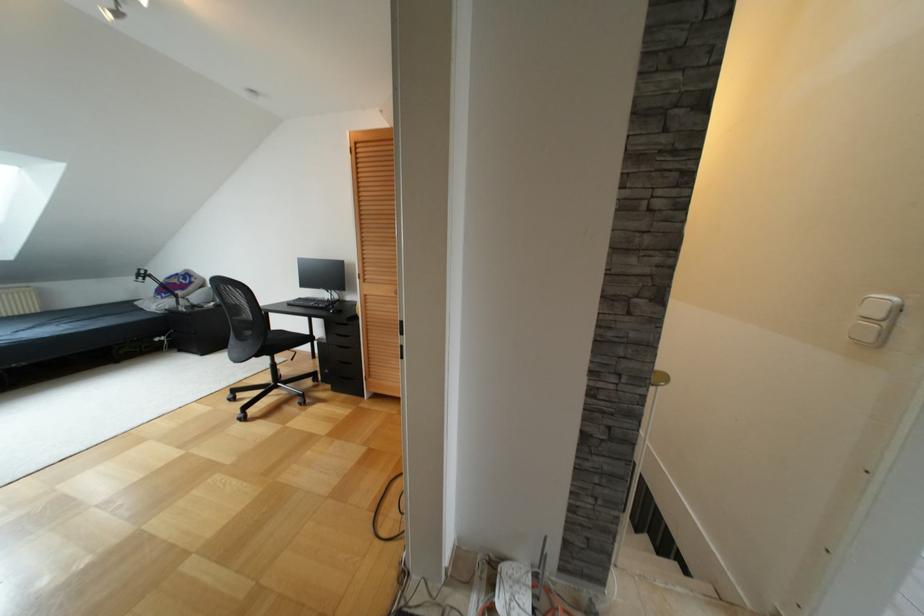
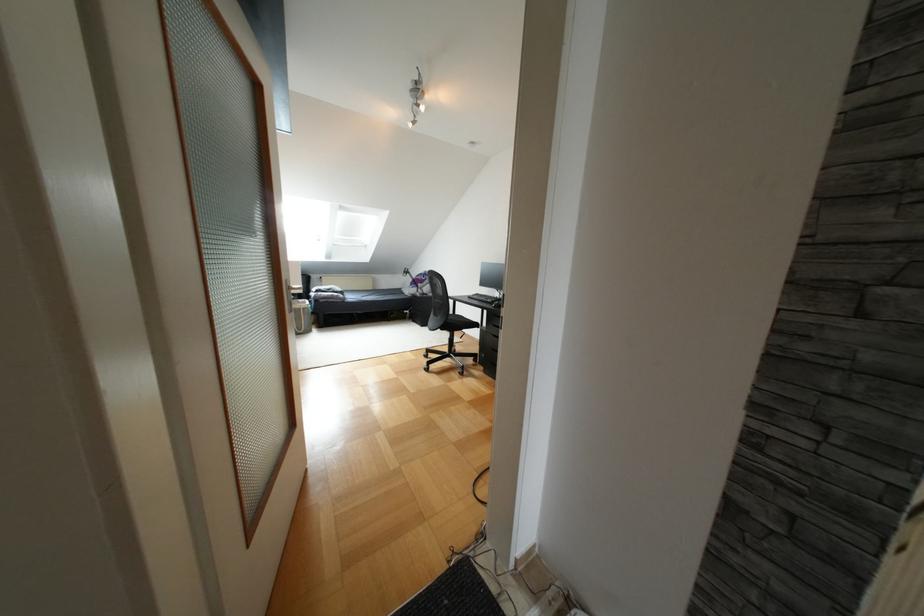
The point at (289,304) is marked in the first image. Where is the corresponding point in the second image?

(468, 297)